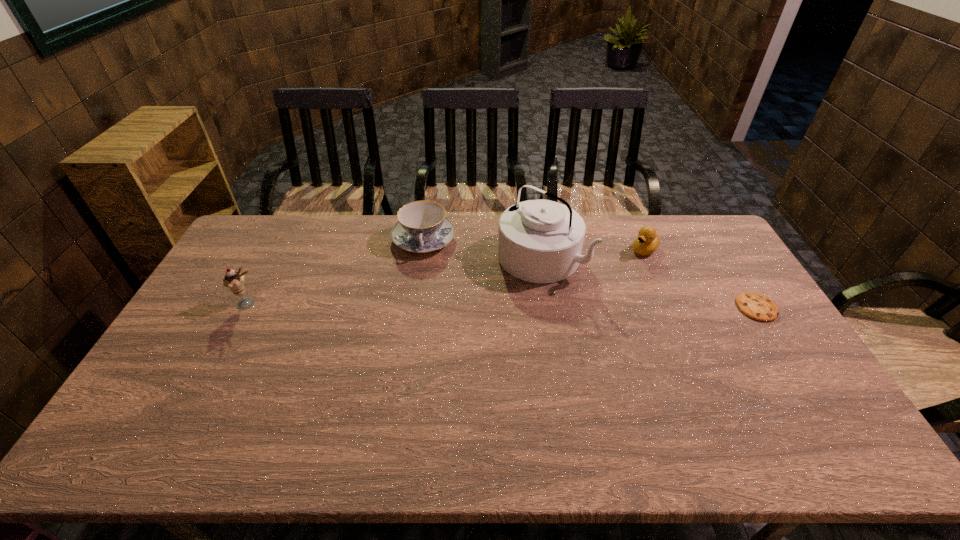
The image size is (960, 540). Identify the location of blank area located with the handle on the side of the chinaware. (427, 342).

Locate an element on the screen. The width and height of the screenshot is (960, 540). vacant area situated 0.100m with the handle on the side of the chinaware is located at coordinates (425, 281).

You are a GUI agent. You are given a task and a screenshot of the screen. Output one action in this format:
    pyautogui.click(x=<x>, y=<y>)
    Task: Click on the vacant area located 0.200m with the handle on the side of the chinaware
    The image size is (960, 540).
    Given the screenshot: What is the action you would take?
    pyautogui.click(x=425, y=302)

Where is `vacant space located 0.140m facing forward on the fourth object from left to right`? This screenshot has height=540, width=960. vacant space located 0.140m facing forward on the fourth object from left to right is located at coordinates (614, 274).

Image resolution: width=960 pixels, height=540 pixels. Find the location of `free space located 0.240m facing forward on the fourth object from left to right`. free space located 0.240m facing forward on the fourth object from left to right is located at coordinates (596, 289).

Locate an element on the screen. The image size is (960, 540). vacant space located facing forward on the fourth object from left to right is located at coordinates 566,314.

Where is `free space located on the spout of the kettle`? The image size is (960, 540). free space located on the spout of the kettle is located at coordinates (488, 300).

I want to click on free space located 0.080m on the spout of the kettle, so click(499, 290).

The width and height of the screenshot is (960, 540). What are the coordinates of `vacant region located 0.190m on the spout of the kettle` in the screenshot? It's located at (477, 309).

You are a GUI agent. You are given a task and a screenshot of the screen. Output one action in this format:
    pyautogui.click(x=<x>, y=<y>)
    Task: Click on the chinaware that is at the far edge
    
    Given the screenshot: What is the action you would take?
    pyautogui.click(x=422, y=227)